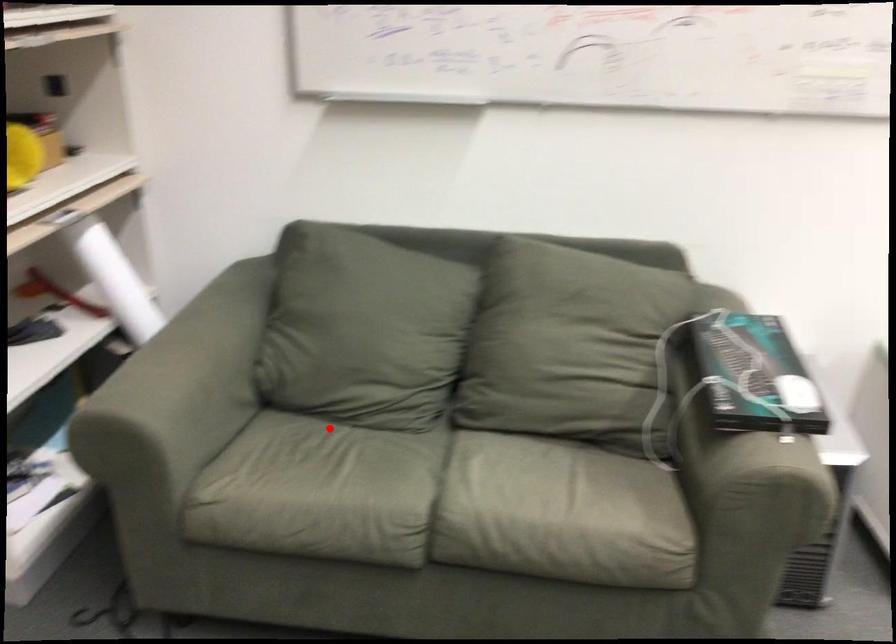
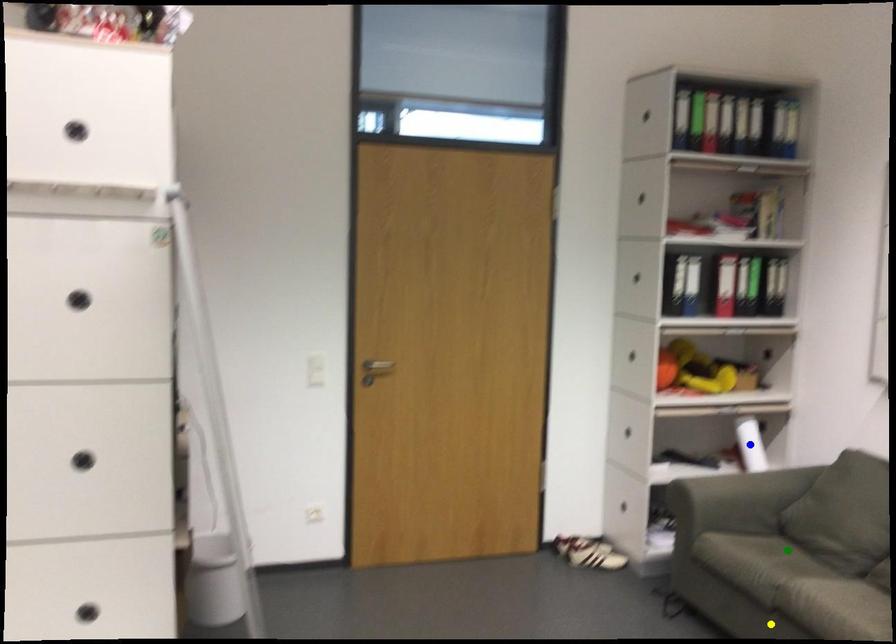
Question: I am providing you with two images of the same scene from different viewpoints. A red point is marked on the first image. You are given multiple points on the second image. Can you choose the point in image 2 that corresponds to the point in image 1?

Choices:
 (A) blue point
 (B) green point
 (C) yellow point

Answer: (B)